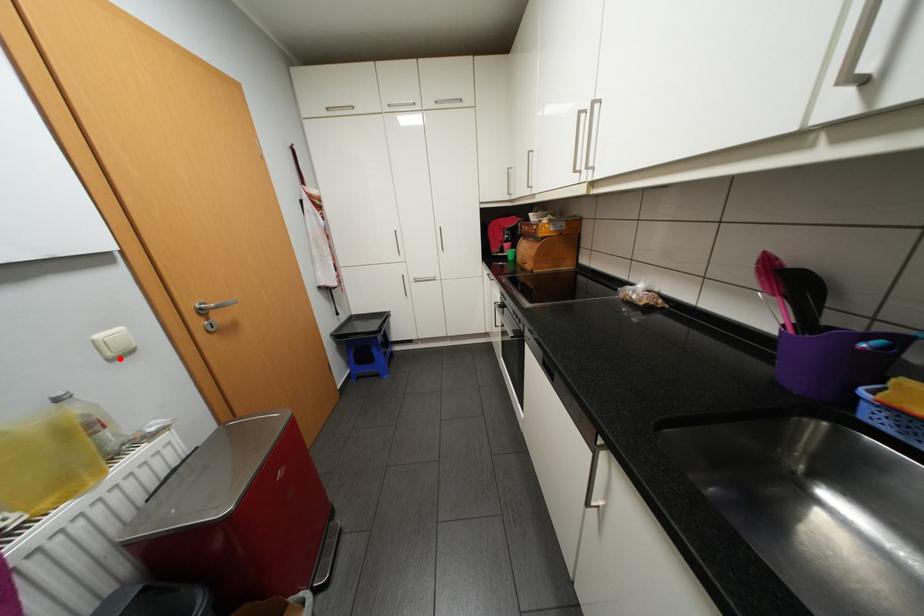
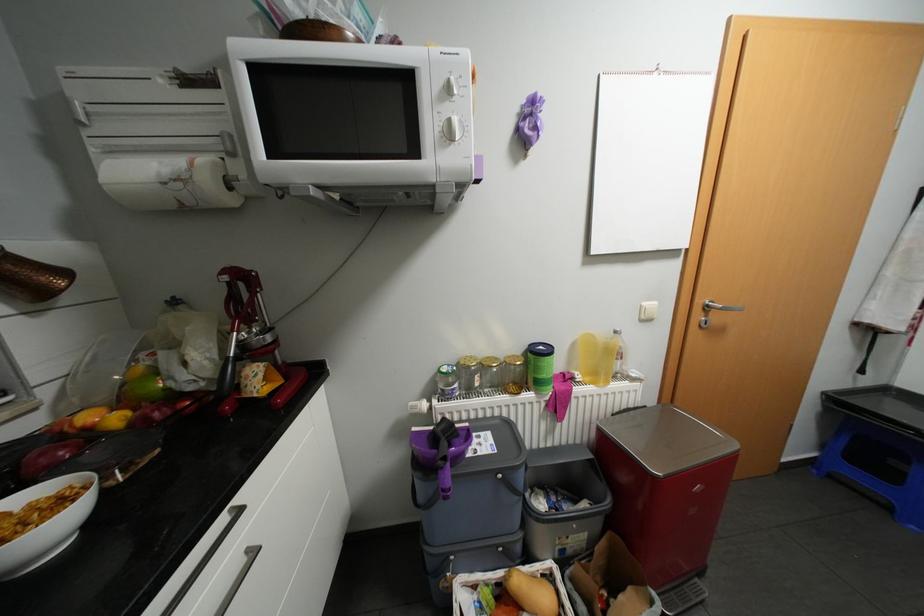
Where in the second image is the point corresponding to the highlighted location from the first image?

(649, 320)